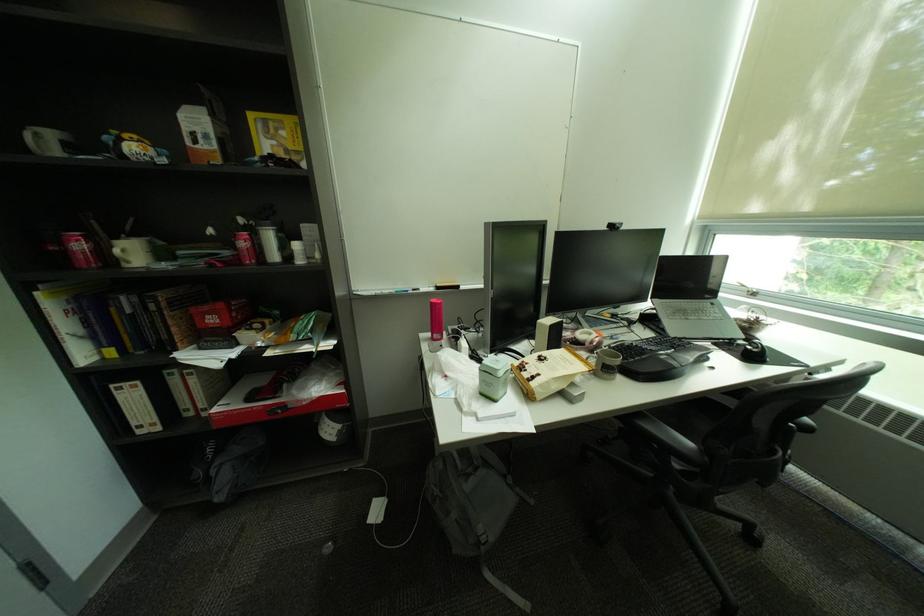
Find where to lift the grey ceramic mug. Please return your answer as a coordinate pair (x, y).

(132, 252)